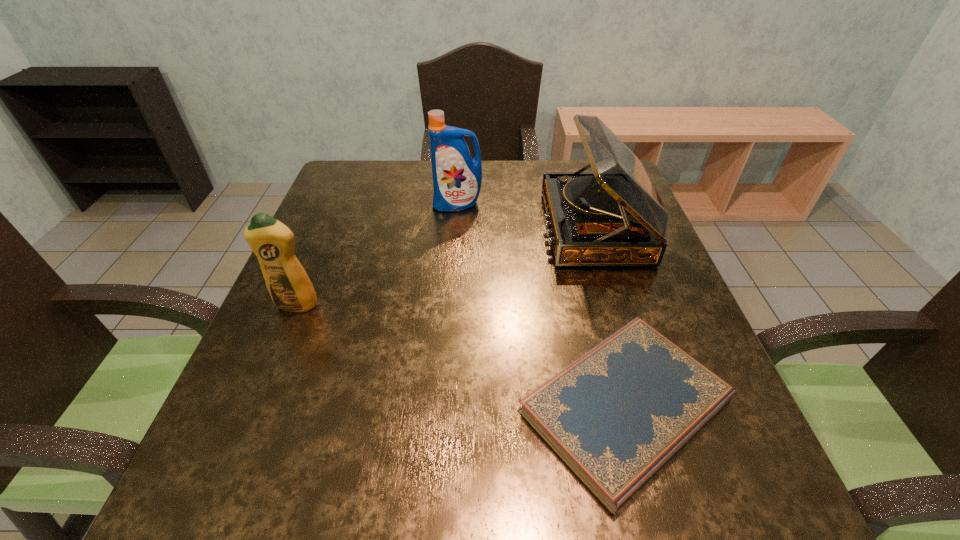
The width and height of the screenshot is (960, 540). Identify the location of vacant point that satisfies the following two spatial constraints: 1. on the label of the right detergent; 2. on the right side of the nearest object. (444, 406).

Where is `vacant space that satisfies the following two spatial constraints: 1. on the label of the farther detergent; 2. on the right side of the paperback book`? Image resolution: width=960 pixels, height=540 pixels. vacant space that satisfies the following two spatial constraints: 1. on the label of the farther detergent; 2. on the right side of the paperback book is located at coordinates click(444, 406).

Where is `blank space that satisfies the following two spatial constraints: 1. on the front-facing side of the record player; 2. on the front side of the paperback book`? Image resolution: width=960 pixels, height=540 pixels. blank space that satisfies the following two spatial constraints: 1. on the front-facing side of the record player; 2. on the front side of the paperback book is located at coordinates (651, 406).

The image size is (960, 540). Identify the location of blank space that satisfies the following two spatial constraints: 1. on the front-facing side of the record player; 2. on the label of the left detergent. (619, 305).

Find the location of a particular element. This screenshot has width=960, height=540. vacant area that satisfies the following two spatial constraints: 1. on the label of the shortest object; 2. on the right side of the right detergent is located at coordinates (444, 406).

Where is `free point that satisfies the following two spatial constraints: 1. on the label of the nearer detergent; 2. on the right side of the paperback book`? This screenshot has height=540, width=960. free point that satisfies the following two spatial constraints: 1. on the label of the nearer detergent; 2. on the right side of the paperback book is located at coordinates (254, 406).